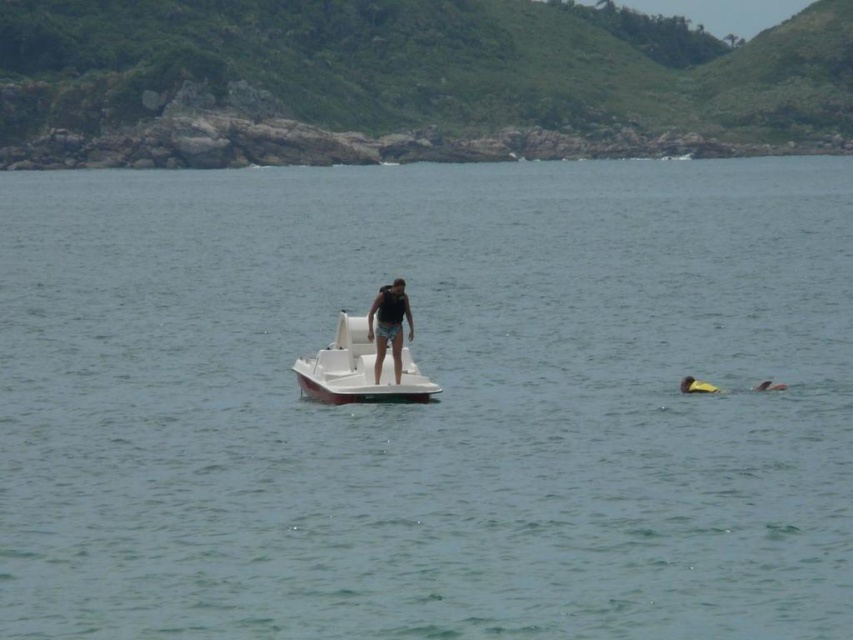
You are a photographer trying to capture the scene of the white matte boat at center and the matte black tank top at center. Which object should you focus on first if you want to capture the taller one?

The matte black tank top at center is taller than the white matte boat at center, so you should focus on the matte black tank top at center first.

You are planning to take a photo of the white matte boat at center and the matte black tank top at center. Which object should you zoom in on to capture the full width of both in a single frame?

The white matte boat at center is wider than the matte black tank top at center, so you should zoom in on the white matte boat at center to ensure both objects fit within the frame.